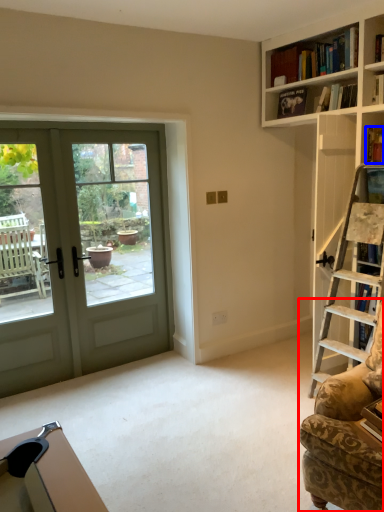
Question: Which object is further to the camera taking this photo, rocking chair (highlighted by a red box) or book (highlighted by a blue box)?

Choices:
 (A) rocking chair
 (B) book

Answer: (B)